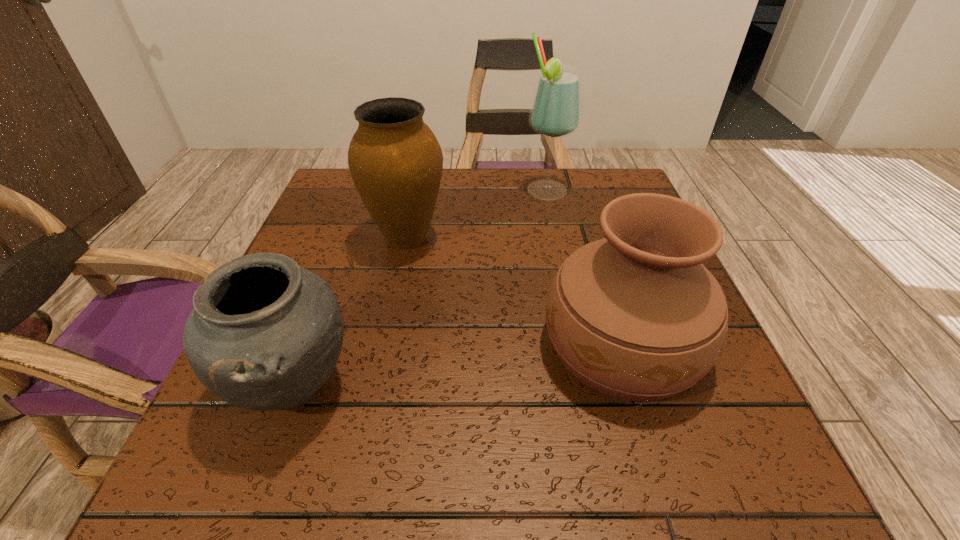
Find the location of a particular element. Image resolution: width=960 pixels, height=540 pixels. free region at the right edge of the desktop is located at coordinates (737, 427).

The image size is (960, 540). I want to click on free space at the near left corner of the desktop, so click(251, 455).

Find the location of a particular element. The height and width of the screenshot is (540, 960). vacant area at the far right corner of the desktop is located at coordinates (590, 173).

In order to click on vacant region at the near right corner of the desktop in this screenshot , I will do `click(676, 467)`.

Image resolution: width=960 pixels, height=540 pixels. What are the coordinates of `free spot between the shortest urn and the farthest object` in the screenshot? It's located at (420, 288).

I want to click on free space between the rightmost urn and the second farthest object, so click(x=515, y=292).

You are a GUI agent. You are given a task and a screenshot of the screen. Output one action in this format:
    pyautogui.click(x=<x>, y=<y>)
    Task: Click on the free space between the farthest urn and the shortest object
    
    Given the screenshot: What is the action you would take?
    pyautogui.click(x=350, y=312)

What are the coordinates of `free spot between the shortest urn and the rightmost urn` in the screenshot? It's located at (458, 365).

You are a GUI agent. You are given a task and a screenshot of the screen. Output one action in this format:
    pyautogui.click(x=<x>, y=<y>)
    Task: Click on the free space between the second farthest object and the rightmost urn
    This screenshot has width=960, height=540.
    Given the screenshot: What is the action you would take?
    pos(515,292)

Where is `vacant point located between the shortest object and the tallest object`? This screenshot has height=540, width=960. vacant point located between the shortest object and the tallest object is located at coordinates (420, 288).